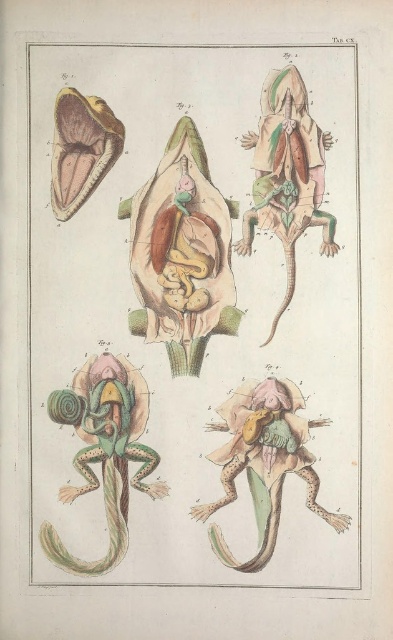
Question: Which object is the closest to the green textured lizard at center?

Choices:
 (A) matte green lizard at bottom right
 (B) green textured frog at lower left

Answer: (B)

Question: Does green textured frog at lower left lie in front of matte pinkish-brown organ at upper left?

Choices:
 (A) yes
 (B) no

Answer: (A)

Question: Is green textured frog at lower left bigger than matte pinkish-brown organ at upper left?

Choices:
 (A) no
 (B) yes

Answer: (B)

Question: Among these objects, which one is farthest from the camera?

Choices:
 (A) matte green lizard at bottom right
 (B) matte pinkish-brown organ at upper left

Answer: (B)

Question: Is green textured lizard at center further to the viewer compared to green textured frog at lower left?

Choices:
 (A) yes
 (B) no

Answer: (A)

Question: Which point is closer to the camera taking this photo?

Choices:
 (A) (225, 420)
 (B) (130, 154)
 (C) (124, 456)
 (D) (67, 166)

Answer: (C)